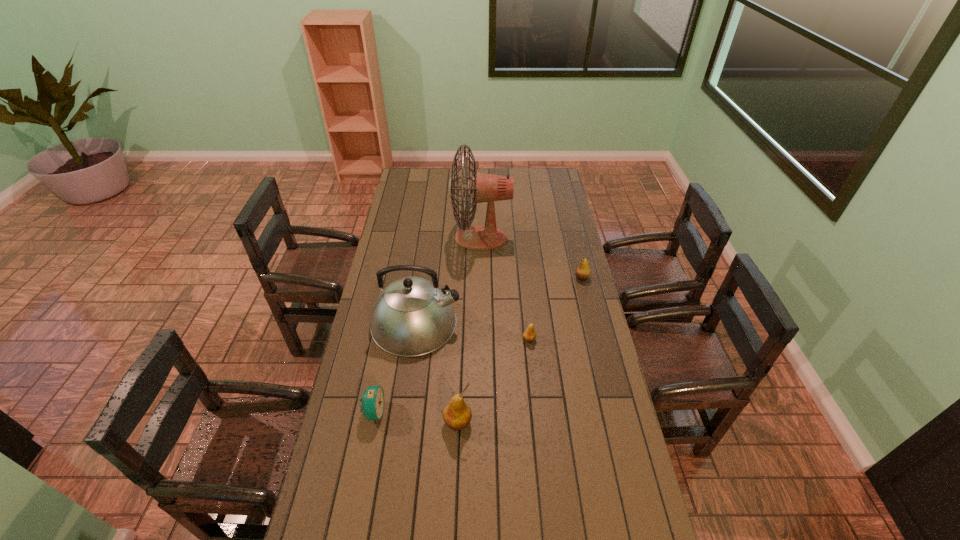
Locate an element on the screen. free point located on the right of the nearest pear is located at coordinates (590, 422).

I want to click on vacant area located 0.230m on the front of the second farthest pear, so click(x=535, y=399).

Identify the location of free space located on the front of the rightmost object. (591, 316).

The width and height of the screenshot is (960, 540). Identify the location of vacant space located from the spout of the kettle. (491, 323).

Identify the location of free space located 0.060m in front of the farthest object to direct airflow. (439, 238).

Where is `vacant point located 0.290m in front of the farthest object to direct airflow`? This screenshot has height=540, width=960. vacant point located 0.290m in front of the farthest object to direct airflow is located at coordinates (391, 238).

Find the location of a particular element. The image size is (960, 540). blank area located in front of the farthest object to direct airflow is located at coordinates (408, 238).

Where is `vacant region located on the front-facing side of the alarm clock`? This screenshot has width=960, height=540. vacant region located on the front-facing side of the alarm clock is located at coordinates (406, 412).

This screenshot has height=540, width=960. Identify the location of kettle located at the left edge. (412, 316).

In order to click on alarm clock present at the left edge in this screenshot , I will do `click(372, 400)`.